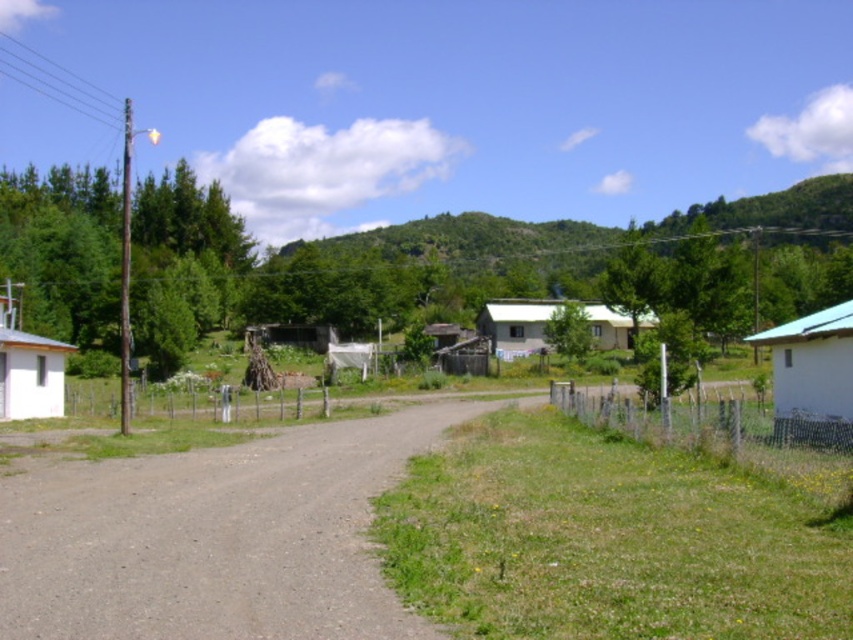
Question: Which is nearer to the white matte hut at left?

Choices:
 (A) wire mesh fence at right
 (B) green wire mesh fence at center
 (C) white matte hut at right
 (D) white matte house at center

Answer: (B)

Question: Which of the following is the closest to the observer?

Choices:
 (A) (786, 376)
 (B) (793, 438)
 (C) (305, 614)

Answer: (C)

Question: Among these points, which one is farthest from the camera?

Choices:
 (A) (604, 314)
 (B) (61, 484)
 (C) (627, 400)

Answer: (A)

Question: Is the position of white matte hut at right less distant than that of white matte hut at left?

Choices:
 (A) yes
 (B) no

Answer: (A)

Question: Is gray gravel road at center closer to camera compared to green wire mesh fence at center?

Choices:
 (A) yes
 (B) no

Answer: (A)

Question: Where is wire mesh fence at right located in relation to white matte house at center in the image?

Choices:
 (A) below
 (B) above

Answer: (A)